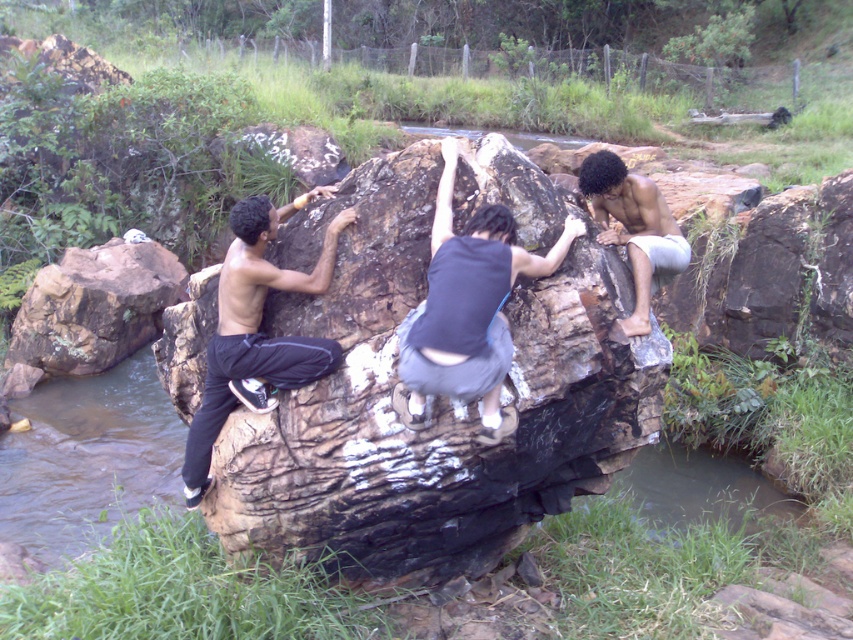
You are a photographer trying to capture the climbers. You notice the black matte pants at left and smooth gray shorts at right. Which climber is closer to the camera?

The black matte pants at left is in front of smooth gray shorts at right, so the climber wearing black matte pants at left is closer to the camera.

You are a hiker who wants to climb the brown rough rock at center. There is a smooth gray shorts at right nearby. Which object is larger in size?

The brown rough rock at center is bigger than the smooth gray shorts at right according to the description.